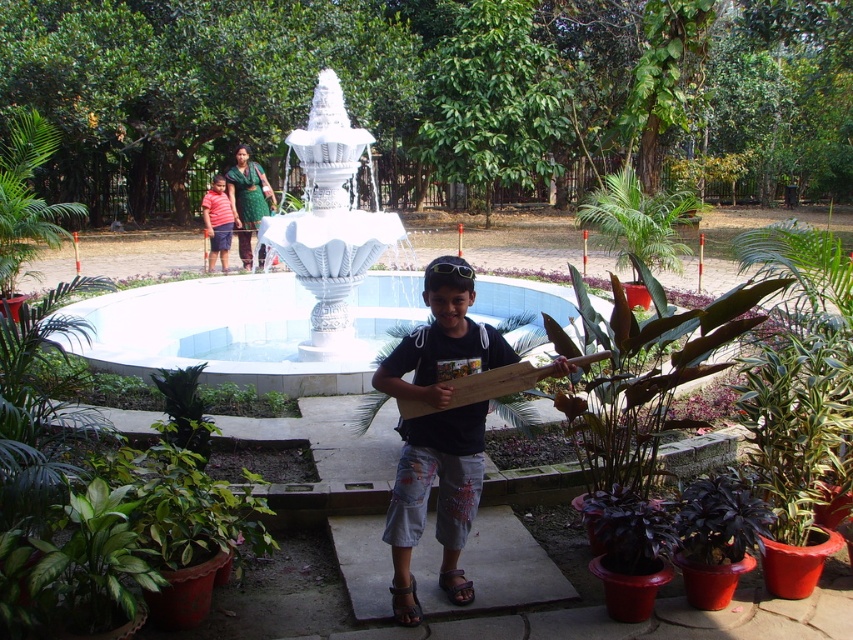
You are a photographer standing near the fountain and you want to take a picture of the striped cotton shirt at left and the green leafy plant at center. Which object should you focus on first to ensure it appears sharp in the photo?

The green leafy plant at center is in front of the striped cotton shirt at left, so you should focus on the green leafy plant at center first to ensure it appears sharp in the photo.